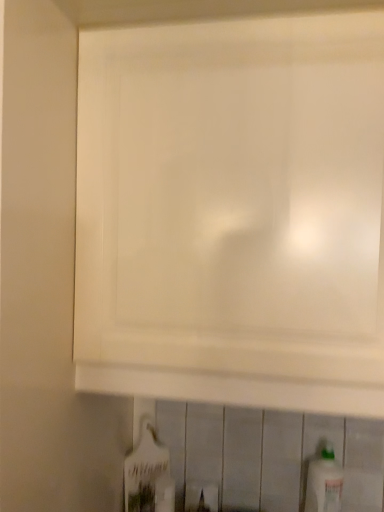
Question: In terms of width, does white plastic bottle at lower right, the first bottle positioned from the right, look wider or thinner when compared to white glossy bottle at lower center, which ranks as the 1th bottle in left-to-right order?

Choices:
 (A) wide
 (B) thin

Answer: (A)

Question: Looking at the image, does white plastic bottle at lower right, the first bottle positioned from the right, seem bigger or smaller compared to white glossy bottle at lower center, which is the 2th bottle in right-to-left order?

Choices:
 (A) big
 (B) small

Answer: (A)

Question: Considering the real-world distances, which object is farthest from the white glossy bottle at lower center, which ranks as the 1th bottle in left-to-right order?

Choices:
 (A) white plastic bottle at lower right, which is the 2th bottle from left to right
 (B) white matte cabinet at upper center

Answer: (B)

Question: Which object is positioned closest to the white plastic bottle at lower right, the first bottle positioned from the right?

Choices:
 (A) white matte cabinet at upper center
 (B) white glossy bottle at lower center, which is the 2th bottle in right-to-left order

Answer: (B)